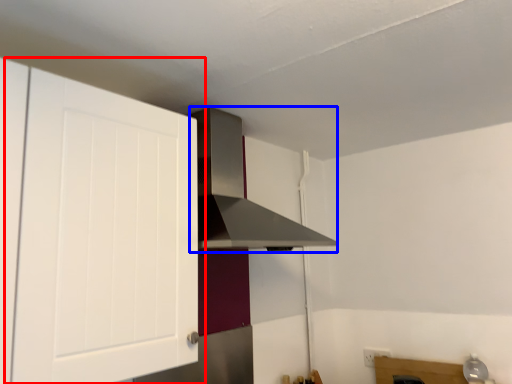
Question: Which of the following is the farthest to the observer, cabinetry (highlighted by a red box) or vent (highlighted by a blue box)?

Choices:
 (A) cabinetry
 (B) vent

Answer: (B)